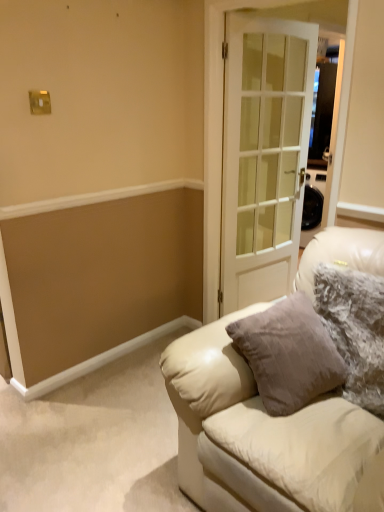
The image size is (384, 512). What do you see at coordinates (259, 434) in the screenshot?
I see `leather couch at center` at bounding box center [259, 434].

What are the coordinates of `white glass door at center` in the screenshot? It's located at (264, 155).

Where is `leather couch at center`? The image size is (384, 512). leather couch at center is located at coordinates (259, 434).

Considering the sizes of objects white glass door at center and leather couch at center in the image provided, who is taller, white glass door at center or leather couch at center?

white glass door at center.

In terms of width, does white glass door at center look wider or thinner when compared to leather couch at center?

Clearly, white glass door at center has less width compared to leather couch at center.

The image size is (384, 512). I want to click on door that appears above the leather couch at center (from the image's perspective), so click(x=264, y=155).

Is white glass door at center situated inside fuzzy fabric pillow at right or outside?

white glass door at center exists outside the volume of fuzzy fabric pillow at right.

Visually, is white glass door at center positioned to the left or to the right of fuzzy fabric pillow at right?

Based on their positions, white glass door at center is located to the left of fuzzy fabric pillow at right.

Looking at this image, from the image's perspective, is white glass door at center above fuzzy fabric pillow at right?

Correct, white glass door at center appears higher than fuzzy fabric pillow at right in the image.

Are white glass door at center and fuzzy fabric pillow at right making contact?

white glass door at center and fuzzy fabric pillow at right are clearly separated.

Based on the photo, is fuzzy fabric pillow at right outside of leather couch at center?

No.

Does fuzzy fabric pillow at right have a greater height compared to leather couch at center?

In fact, fuzzy fabric pillow at right may be shorter than leather couch at center.

Considering the points (363, 373) and (319, 402), which point is in front, point (363, 373) or point (319, 402)?

Positioned in front is point (319, 402).

Image resolution: width=384 pixels, height=512 pixels. I want to click on pillow lying above the leather couch at center (from the image's perspective), so click(x=355, y=330).

Considering the sizes of leather couch at center and fuzzy fabric pillow at right in the image, is leather couch at center wider or thinner than fuzzy fabric pillow at right?

Considering their sizes, leather couch at center looks broader than fuzzy fabric pillow at right.

I want to click on pillow behind the leather couch at center, so click(x=355, y=330).

Looking at this image, does leather couch at center have a larger size compared to fuzzy fabric pillow at right?

Indeed, leather couch at center has a larger size compared to fuzzy fabric pillow at right.

Does leather couch at center turn towards fuzzy fabric pillow at right?

Yes, leather couch at center is aimed at fuzzy fabric pillow at right.

How different are the orientations of fuzzy fabric pillow at right and white glass door at center in degrees?

The facing directions of fuzzy fabric pillow at right and white glass door at center are 85.7 degrees apart.

Would you say fuzzy fabric pillow at right is inside or outside white glass door at center?

fuzzy fabric pillow at right is outside white glass door at center.

From the image's perspective, which one is positioned higher, fuzzy fabric pillow at right or white glass door at center?

From the image's view, white glass door at center is above.

Who is shorter, fuzzy fabric pillow at right or white glass door at center?

fuzzy fabric pillow at right is shorter.

I want to click on studio couch on the left of white glass door at center, so click(x=259, y=434).

From a real-world perspective, does leather couch at center stand above white glass door at center?

No, from a real-world perspective, leather couch at center is not above white glass door at center.

Is leather couch at center not inside white glass door at center?

Yes, leather couch at center is located beyond the bounds of white glass door at center.

Which point is more distant from viewer, (225, 426) or (244, 221)?

Positioned behind is point (244, 221).

At what (x,y) coordinates should I click in order to perform the action: click on studio couch located in front of the white glass door at center. Please return your answer as a coordinate pair (x, y). This screenshot has height=512, width=384. Looking at the image, I should click on (259, 434).

The image size is (384, 512). Find the location of `door above the fuzzy fabric pillow at right (from a real-world perspective)`. door above the fuzzy fabric pillow at right (from a real-world perspective) is located at coordinates (264, 155).

Which object lies further to the anchor point white glass door at center, fuzzy fabric pillow at right or leather couch at center?

Based on the image, leather couch at center appears to be further to white glass door at center.

Looking at the image, which one is located closer to white glass door at center, leather couch at center or fuzzy fabric pillow at right?

fuzzy fabric pillow at right is closer to white glass door at center.

When comparing their distances from leather couch at center, does fuzzy fabric pillow at right or white glass door at center seem further?

Among the two, white glass door at center is located further to leather couch at center.

Looking at the image, which one is located further to fuzzy fabric pillow at right, white glass door at center or leather couch at center?

white glass door at center is further to fuzzy fabric pillow at right.

Considering their positions, is white glass door at center positioned closer to leather couch at center than fuzzy fabric pillow at right?

fuzzy fabric pillow at right is positioned closer to the anchor leather couch at center.

Considering their positions, is leather couch at center positioned further to fuzzy fabric pillow at right than white glass door at center?

Among the two, white glass door at center is located further to fuzzy fabric pillow at right.

What are the coordinates of `pillow located between leather couch at center and white glass door at center in the depth direction` in the screenshot? It's located at (355, 330).